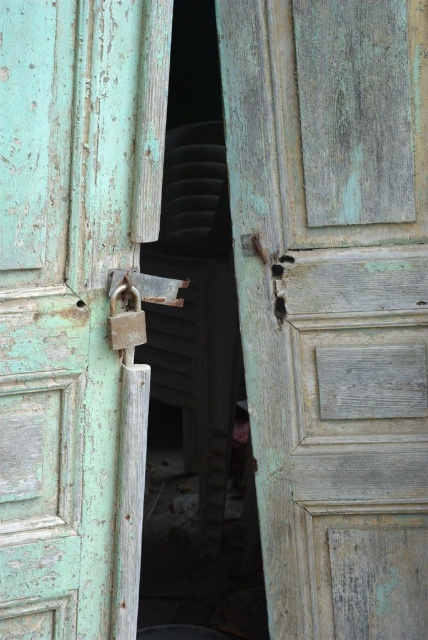
Does point (285, 588) come farther from viewer compared to point (122, 333)?

Yes, it is behind point (122, 333).

From the picture: Can you confirm if peeling teal wood door at center is bigger than rusty metal padlock at center?

Indeed, peeling teal wood door at center has a larger size compared to rusty metal padlock at center.

Between point (383, 353) and point (137, 291), which one is positioned behind?

The point (383, 353) is more distant.

Where is `peeling teal wood door at center`? Image resolution: width=428 pixels, height=640 pixels. peeling teal wood door at center is located at coordinates (333, 304).

Can you confirm if green weathered wood door at left is wider than metallic padlock at center?

Yes, green weathered wood door at left is wider than metallic padlock at center.

I want to click on green weathered wood door at left, so click(x=74, y=305).

Who is more distant from viewer, (x=262, y=3) or (x=145, y=294)?

The point (x=262, y=3) is more distant.

Is point (415, 182) positioned before point (140, 321)?

That is False.

The image size is (428, 640). Identify the location of peeling teal wood door at center. (333, 304).